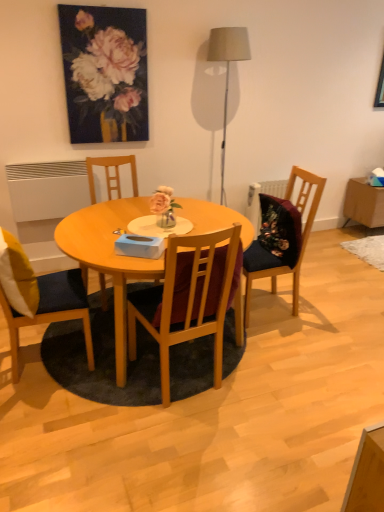
In the image, there is a oil painting at upper center. From a real-world perspective, locate several spots within the vacant space situated above oil painting at upper center. Your answer should be formatted as a list of tuples, i.e. [(x1, y1)], where each tuple contains the x and y coordinates of a point satisfying the conditions above.

[(0.343, -0.000)]